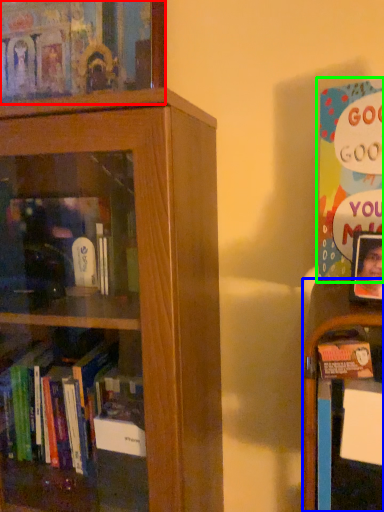
Question: Which is nearer to the book (highlighted by a red box)? shelf (highlighted by a blue box) or book (highlighted by a green box).

Choices:
 (A) shelf
 (B) book

Answer: (B)